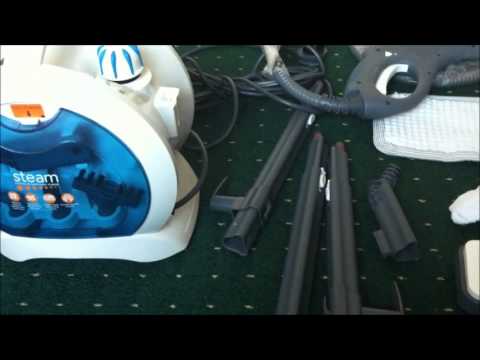
In order to click on dark carpet in this screenshot , I will do `click(269, 258)`.